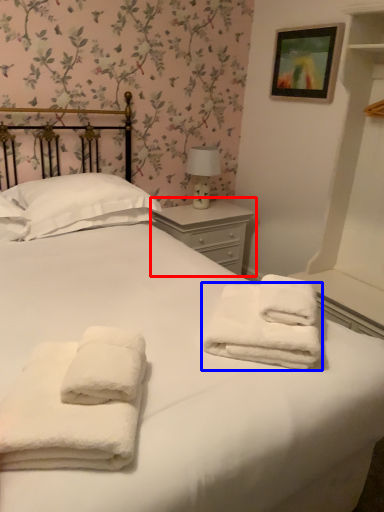
Question: Which object is closer to the camera taking this photo, nightstand (highlighted by a red box) or towel (highlighted by a blue box)?

Choices:
 (A) nightstand
 (B) towel

Answer: (B)